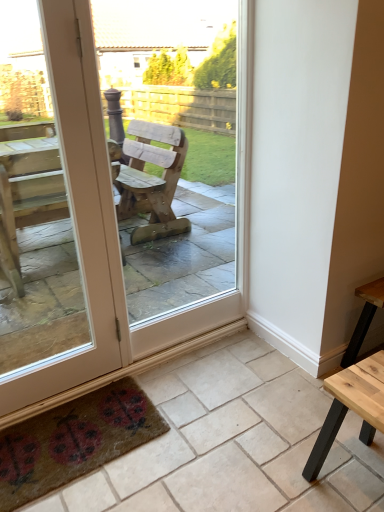
At what (x,y) coordinates should I click in order to perform the action: click on vacant space that's between light brown wooden table at lower right and textured brown mat with ladybugs at lower left. Please return your answer as a coordinate pair (x, y). Looking at the image, I should click on click(207, 452).